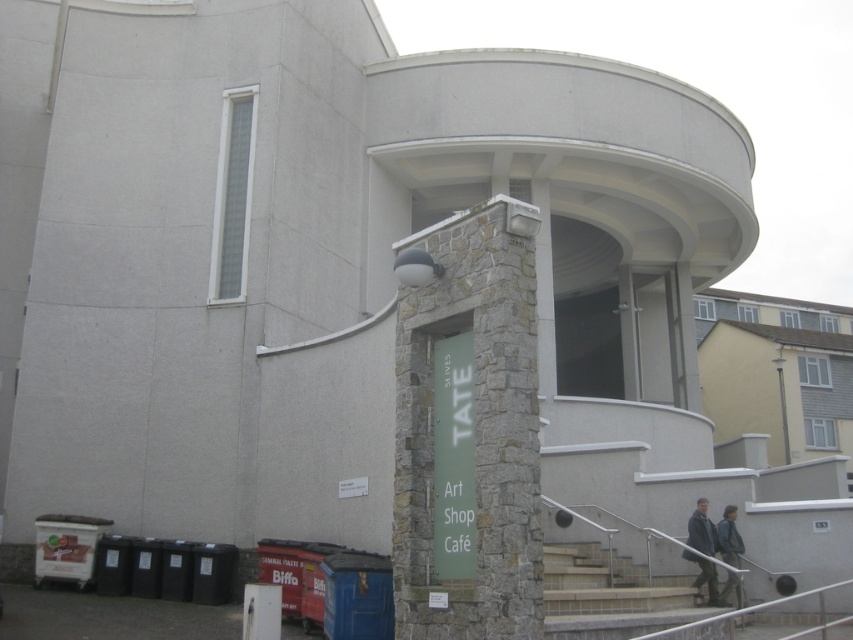
You are a delivery person carrying a large box that is 2 meters wide. You need to navigate through the Tate St Ives art gallery exterior. Can you pass through the space between the smooth concrete stairs at lower center and the green fabric jacket at lower right without the box touching either object? Please explain your reasoning.

The smooth concrete stairs at lower center are wider than the green fabric jacket at lower right. However, the exact width of the space between them isn not provided. Since the box is 2 meters wide, it might be possible if the gap is sufficiently large. But without specific measurements, we cannot confirm. However, based on the description that the stairs are wider, it suggests the space might be narrow. Therefore, it is uncertain and risky to attempt without more information.

You are standing at the entrance of the Tate St Ives art gallery and see the smooth concrete stairs at lower center and the dark gray jacket at lower right. Which object is positioned to the left of the other?

The smooth concrete stairs at lower center is to the left of dark gray jacket at lower right.